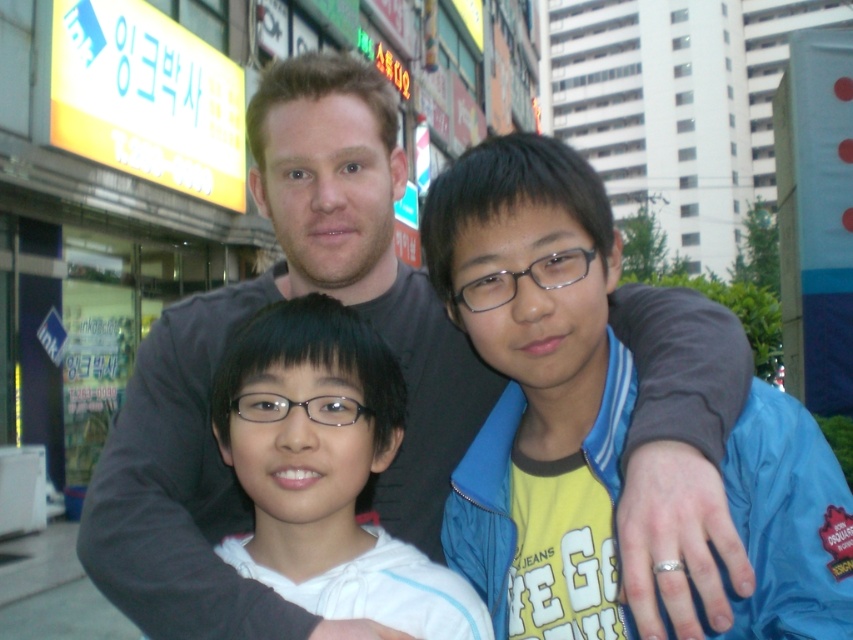
You are a photographer standing 2 meters away from the blue fabric jacket at center. Can you take a clear photo of it without moving closer?

The blue fabric jacket at center is 1.73 meters away from the viewer. Since you are standing 2 meters away, you are farther than the jacket, so you can take a clear photo without moving closer by adjusting your camera zoom or using a telephoto lens.

You are a photographer standing 6 feet away from the camera. You want to take a photo of the gray matte shirt at center. Can you move closer to the shirt to get a better shot without exceeding the 6 feet distance limit?

The gray matte shirt at center and camera are 5.53 feet apart from each other. Since you are standing 6 feet away from the camera, you can move closer to the gray matte shirt at center as long as you stay within the 6 feet distance limit from the camera.

You are a photographer taking a group photo of the gray matte shirt at center and the white matte hoodie at center. Which of the two should you move closer to the camera to make their sizes appear more balanced in the photo?

Since the gray matte shirt at center is larger in size compared to the white matte hoodie at center, you should move the white matte hoodie at center closer to the camera to balance their sizes in the photo.